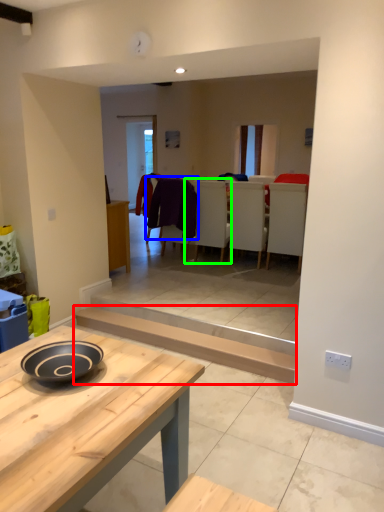
Question: Which is farther away from plank (highlighted by a red box)? laundry (highlighted by a blue box) or armchair (highlighted by a green box)?

Choices:
 (A) laundry
 (B) armchair

Answer: (B)